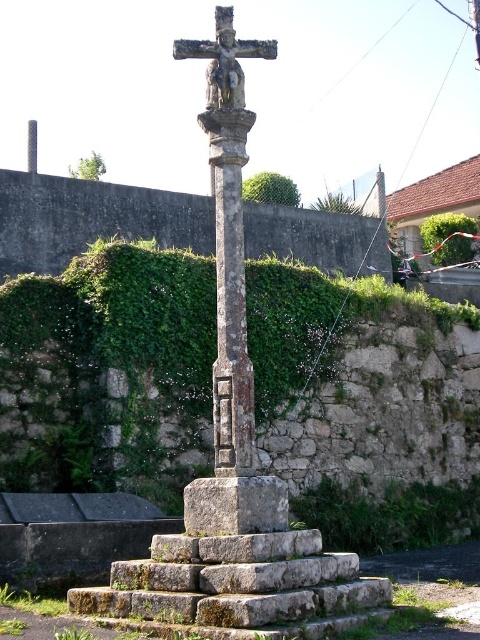
Which is below, rusty stone column at center or gray stone at center?

gray stone at center is below.

Does point (219, 408) lie behind point (243, 520)?

Yes, it is behind point (243, 520).

Which is in front, point (222, 356) or point (263, 529)?

Positioned in front is point (263, 529).

This screenshot has width=480, height=640. I want to click on rusty stone column at center, so click(x=230, y=296).

Does point (228, 416) come in front of point (427, 234)?

Yes, point (228, 416) is in front of point (427, 234).

Between rusty stone column at center and green leafy hedge at upper right, which one appears on the right side from the viewer's perspective?

green leafy hedge at upper right

This screenshot has width=480, height=640. What do you see at coordinates (230, 296) in the screenshot?
I see `rusty stone column at center` at bounding box center [230, 296].

I want to click on rusty stone column at center, so click(x=230, y=296).

Measure the distance between rusty stone cross at center and green leafy hedge at upper center.

12.82 meters

The height and width of the screenshot is (640, 480). I want to click on rusty stone cross at center, so click(x=228, y=236).

Find the location of a particular element. rusty stone cross at center is located at coordinates (228, 236).

Where is `rusty stone cross at center`? Image resolution: width=480 pixels, height=640 pixels. rusty stone cross at center is located at coordinates (228, 236).